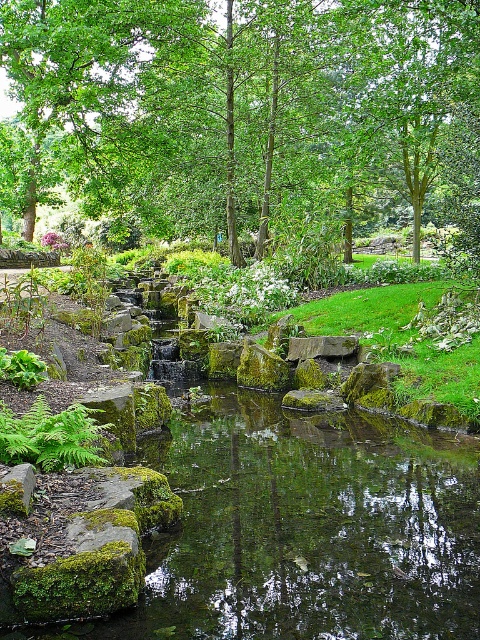
You are a gardener planning to place a decorative statue that is 30 cm tall in this garden scene. Given the green matte fern at lower left and the green mossy stone at center, which object would be more suitable to place the statue next to based on their sizes?

The green mossy stone at center is smaller than the green matte fern at lower left, so placing the statue next to the green mossy stone at center would be more suitable as it allows the statue to stand out more due to its size contrast.

You are standing in the garden looking at the green leafy tree at upper center and the green matte fern at lower left. Which plant is positioned higher in the scene?

The green leafy tree at upper center is positioned higher than the green matte fern at lower left.